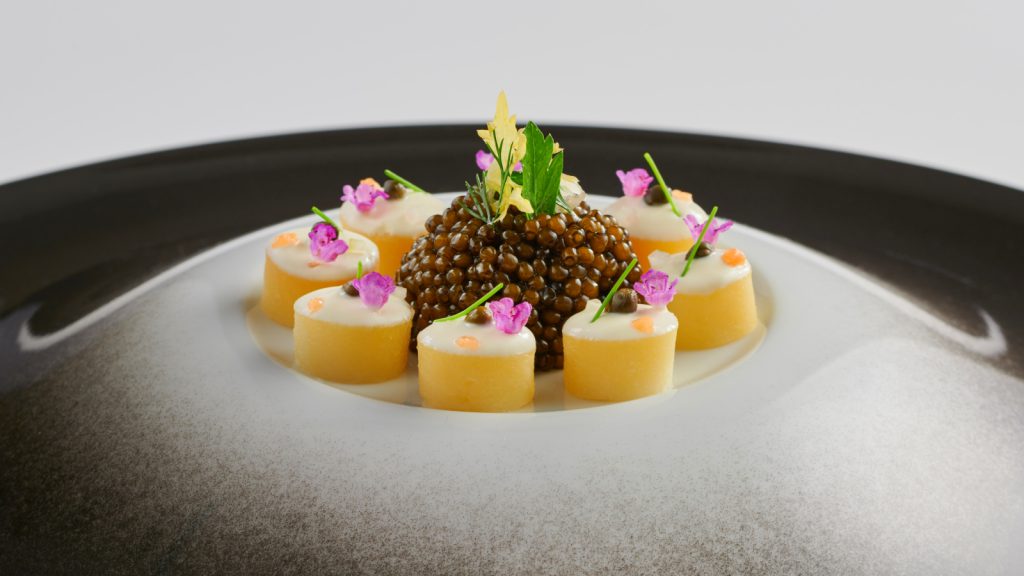
Identify the location of black pot. This screenshot has height=576, width=1024. click(956, 185).